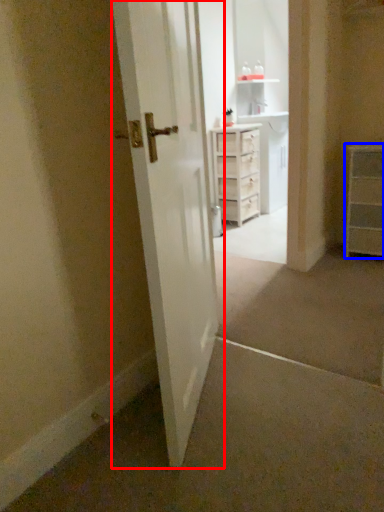
Question: Which of the following is the closest to the observer, door (highlighted by a red box) or chest of drawers (highlighted by a blue box)?

Choices:
 (A) door
 (B) chest of drawers

Answer: (A)